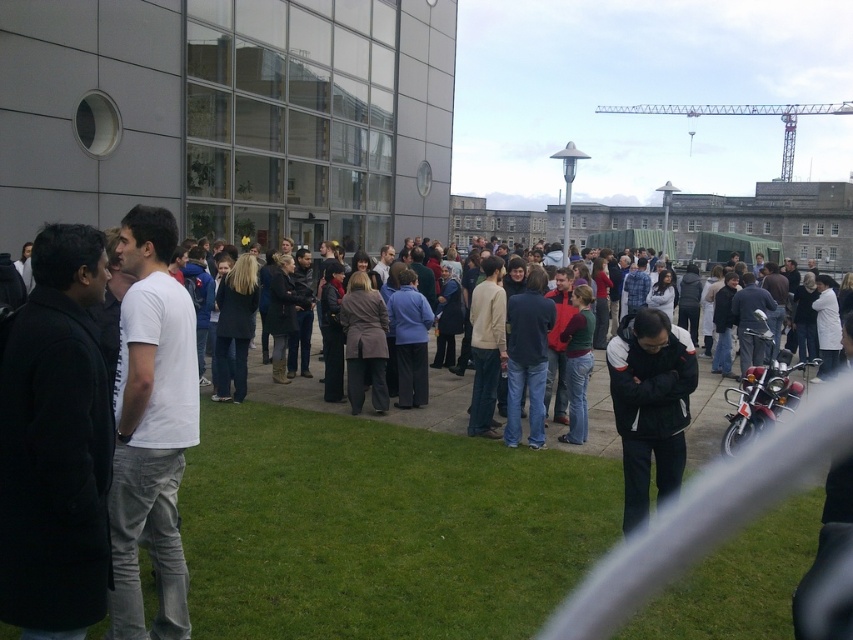
Question: Does green grass at lower center appear over dark gray wool coat at left?

Choices:
 (A) yes
 (B) no

Answer: (B)

Question: Is dark gray wool coat at left positioned behind black fleece jacket at center?

Choices:
 (A) yes
 (B) no

Answer: (B)

Question: Based on their relative distances, which object is farther from the dark gray wool coat at left?

Choices:
 (A) black fleece jacket at center
 (B) green grass at lower center
 (C) white cotton t-shirt at left

Answer: (B)

Question: Estimate the real-world distances between objects in this image. Which object is closer to the dark gray wool coat at left?

Choices:
 (A) green grass at lower center
 (B) black fleece jacket at center
 (C) white cotton t-shirt at left

Answer: (C)

Question: Is green grass at lower center to the left of white cotton t-shirt at left from the viewer's perspective?

Choices:
 (A) yes
 (B) no

Answer: (B)

Question: Which of the following is the farthest from the observer?

Choices:
 (A) black fleece jacket at center
 (B) white cotton t-shirt at left

Answer: (A)